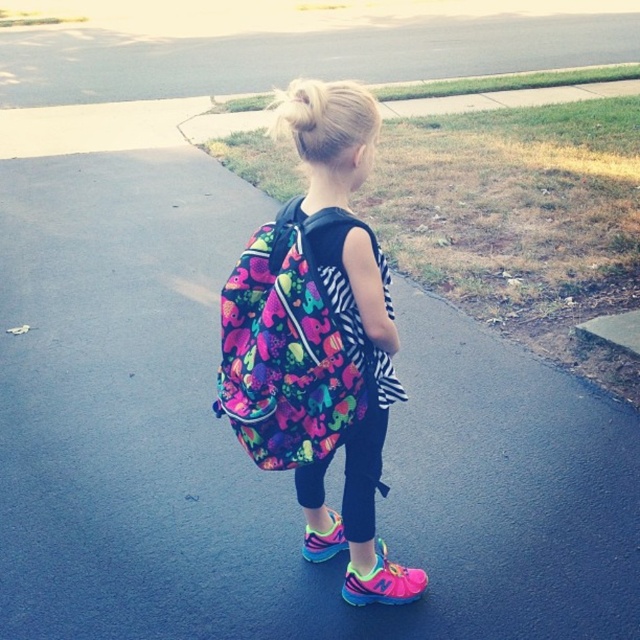
Is multicolored fabric backpack at center above green grass at upper center?

No, multicolored fabric backpack at center is not above green grass at upper center.

Is multicolored fabric backpack at center below green grass at upper center?

Yes.

Is point (298, 253) behind point (541, 77)?

No.

Image resolution: width=640 pixels, height=640 pixels. Find the location of `multicolored fabric backpack at center`. multicolored fabric backpack at center is located at coordinates (289, 348).

Can you confirm if pink mesh shoe at lower center is taller than pink fabric shoe at lower center?

No.

Is pink mesh shoe at lower center closer to the viewer compared to pink fabric shoe at lower center?

Yes, pink mesh shoe at lower center is in front of pink fabric shoe at lower center.

Does point (365, 589) come behind point (330, 538)?

No.

Locate an element on the screen. pink mesh shoe at lower center is located at coordinates (381, 582).

Which is below, multicolored fabric backpack at center or pink fabric shoe at lower center?

Positioned lower is pink fabric shoe at lower center.

Who is more distant from viewer, (262, 316) or (323, 561)?

Positioned behind is point (323, 561).

Find the location of a particular element. This screenshot has width=640, height=640. multicolored fabric backpack at center is located at coordinates (289, 348).